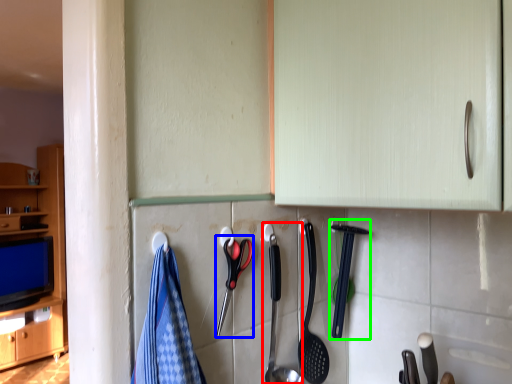
Question: Which object is the farthest from silverware (highlighted by a red box)? Choose among these: scissors (highlighted by a blue box) or silverware (highlighted by a green box).

Choices:
 (A) scissors
 (B) silverware

Answer: (B)